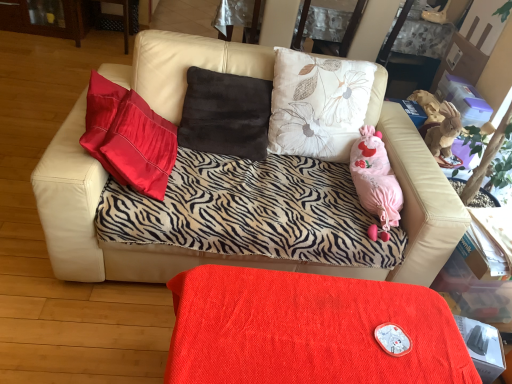
At what (x,y) coordinates should I click in order to perform the action: click on zebra-patterned fabric couch at center. Please return your answer as a coordinate pair (x, y). Image resolution: width=512 pixels, height=384 pixels. Looking at the image, I should click on (238, 256).

The height and width of the screenshot is (384, 512). What do you see at coordinates (238, 256) in the screenshot?
I see `zebra-patterned fabric couch at center` at bounding box center [238, 256].

The height and width of the screenshot is (384, 512). Describe the element at coordinates (308, 330) in the screenshot. I see `velvet red table at lower center` at that location.

In the scene shown: Measure the distance between point [210,302] and camera.

Point [210,302] is 1.19 meters away from camera.

Where is `velvet red table at lower center`? The image size is (512, 384). velvet red table at lower center is located at coordinates (308, 330).

What is the approximate height of velvet red table at lower center?

velvet red table at lower center is 43.74 centimeters in height.

At what (x,y) coordinates should I click in order to perform the action: click on zebra-patterned fabric couch at center. Please return your answer as a coordinate pair (x, y). The width and height of the screenshot is (512, 384). Looking at the image, I should click on point(238,256).

Between velvet red table at lower center and zebra-patterned fabric couch at center, which one appears on the left side from the viewer's perspective?

zebra-patterned fabric couch at center.

Is velvet red table at lower center positioned behind zebra-patterned fabric couch at center?

No, the depth of velvet red table at lower center is less than that of zebra-patterned fabric couch at center.

Between point (208, 291) and point (425, 247), which one is positioned behind?

Positioned behind is point (425, 247).

From the image's perspective, between velvet red table at lower center and zebra-patterned fabric couch at center, which one is located above?

zebra-patterned fabric couch at center is shown above in the image.

From a real-world perspective, is velvet red table at lower center beneath zebra-patterned fabric couch at center?

Yes.

In terms of width, does velvet red table at lower center look wider or thinner when compared to zebra-patterned fabric couch at center?

In the image, velvet red table at lower center appears to be more narrow than zebra-patterned fabric couch at center.

Can you confirm if velvet red table at lower center is taller than zebra-patterned fabric couch at center?

Incorrect, the height of velvet red table at lower center is not larger of that of zebra-patterned fabric couch at center.

Considering the sizes of velvet red table at lower center and zebra-patterned fabric couch at center in the image, is velvet red table at lower center bigger or smaller than zebra-patterned fabric couch at center?

velvet red table at lower center is smaller than zebra-patterned fabric couch at center.

Is zebra-patterned fabric couch at center completely or partially inside velvet red table at lower center?

No, zebra-patterned fabric couch at center is not inside velvet red table at lower center.

Is velvet red table at lower center next to zebra-patterned fabric couch at center and touching it?

They are not placed beside each other.

Could you tell me if velvet red table at lower center is turned towards zebra-patterned fabric couch at center?

No, velvet red table at lower center is not turned towards zebra-patterned fabric couch at center.

What's the angular difference between velvet red table at lower center and zebra-patterned fabric couch at center's facing directions?

The angular difference between velvet red table at lower center and zebra-patterned fabric couch at center is 89.9 degrees.

In order to click on table directly beneath the zebra-patterned fabric couch at center (from a real-world perspective) in this screenshot , I will do `click(308, 330)`.

From the picture: Between zebra-patterned fabric couch at center and velvet red table at lower center, which one appears on the right side from the viewer's perspective?

velvet red table at lower center is more to the right.

Which object is further away from the camera taking this photo, zebra-patterned fabric couch at center or velvet red table at lower center?

zebra-patterned fabric couch at center is further from the camera.

Which is less distant, (447, 259) or (340, 364)?

The point (340, 364) is in front.

From the image's perspective, between zebra-patterned fabric couch at center and velvet red table at lower center, who is located below?

velvet red table at lower center appears lower in the image.

From a real-world perspective, is zebra-patterned fabric couch at center above or below velvet red table at lower center?

In terms of real-world spatial position, zebra-patterned fabric couch at center is above velvet red table at lower center.

Which object is thinner, zebra-patterned fabric couch at center or velvet red table at lower center?

velvet red table at lower center is thinner.

Looking at this image, who is taller, zebra-patterned fabric couch at center or velvet red table at lower center?

zebra-patterned fabric couch at center.

Considering the sizes of objects zebra-patterned fabric couch at center and velvet red table at lower center in the image provided, who is smaller, zebra-patterned fabric couch at center or velvet red table at lower center?

velvet red table at lower center.

Would you say zebra-patterned fabric couch at center is outside velvet red table at lower center?

Yes.

Is zebra-patterned fabric couch at center positioned far away from velvet red table at lower center?

zebra-patterned fabric couch at center is actually quite close to velvet red table at lower center.

Is zebra-patterned fabric couch at center looking in the opposite direction of velvet red table at lower center?

No, zebra-patterned fabric couch at center is not facing away from velvet red table at lower center.

Locate an element on the screen. The height and width of the screenshot is (384, 512). studio couch that appears on the left of velvet red table at lower center is located at coordinates (238, 256).

Identify the location of table in front of the zebra-patterned fabric couch at center. The image size is (512, 384). (308, 330).

The height and width of the screenshot is (384, 512). I want to click on table beneath the zebra-patterned fabric couch at center (from a real-world perspective), so click(x=308, y=330).